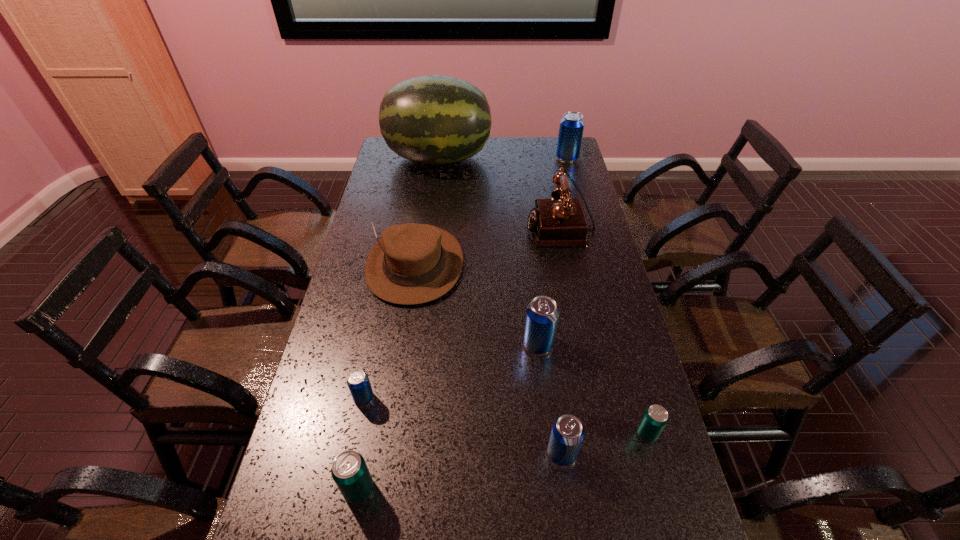
At what (x,y) coordinates should I click in order to perform the action: click on free location located on the feather side of the fedora. Please return your answer as a coordinate pair (x, y). Image resolution: width=960 pixels, height=540 pixels. Looking at the image, I should click on (397, 382).

Find the location of a particular element. The width and height of the screenshot is (960, 540). blank space located 0.380m on the back of the third nearest blue beer can is located at coordinates (527, 246).

Find the location of a particular element. Image resolution: width=960 pixels, height=540 pixels. free space located 0.070m on the back of the nearest object is located at coordinates (368, 443).

Image resolution: width=960 pixels, height=540 pixels. Find the location of `vacant space located 0.080m on the right of the nearest blue beer can`. vacant space located 0.080m on the right of the nearest blue beer can is located at coordinates (611, 453).

The image size is (960, 540). I want to click on vacant space situated 0.340m on the back of the leftmost blue beer can, so click(386, 294).

The height and width of the screenshot is (540, 960). I want to click on free space located on the left of the farther teal beer can, so click(x=479, y=434).

Identify the location of watermelon located at the far edge. The width and height of the screenshot is (960, 540). (433, 119).

Find the location of a particular element. beer can that is at the far edge is located at coordinates (571, 128).

The width and height of the screenshot is (960, 540). What are the coordinates of `watermelon located at the left edge` in the screenshot? It's located at (433, 119).

At what (x,y) coordinates should I click in order to perform the action: click on fedora that is at the left edge. Please return your answer as a coordinate pair (x, y). The height and width of the screenshot is (540, 960). Looking at the image, I should click on (411, 263).